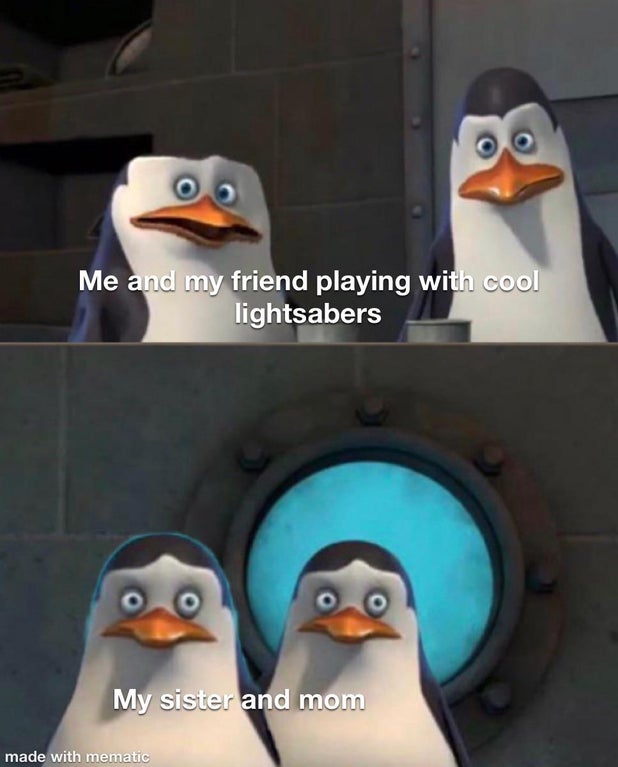
What are the coordinates of `concrete wall` in the screenshot? It's located at (176, 468), (320, 192).